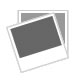
Locate an element on the screen. Image resolution: width=80 pixels, height=80 pixels. picture space is located at coordinates (26, 16), (34, 36).